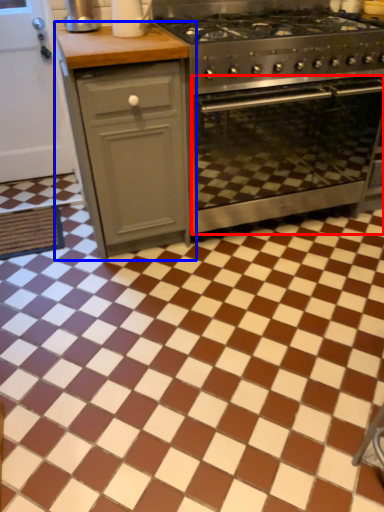
Question: Which point is closer to the camera, oven (highlighted by a red box) or cabinetry (highlighted by a blue box)?

Choices:
 (A) oven
 (B) cabinetry

Answer: (B)